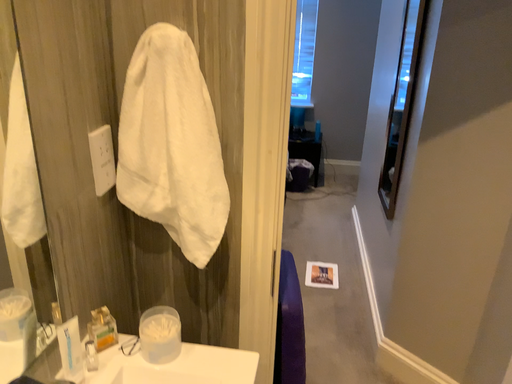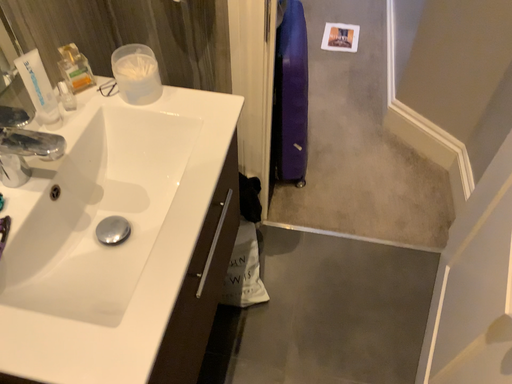
Question: How did the camera likely rotate when shooting the video?

Choices:
 (A) rotated downward
 (B) rotated upward

Answer: (A)